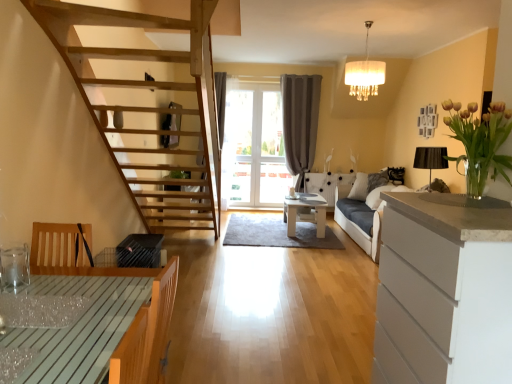
At what (x,y) coordinates should I click in order to perform the action: click on translucent glass vase at upper right. Please return your answer as a coordinate pair (x, y). Looking at the image, I should click on (480, 142).

Describe the element at coordinates (362, 214) in the screenshot. I see `dark gray fabric couch at right` at that location.

What do you see at coordinates (365, 74) in the screenshot?
I see `white fabric lampshade at upper center` at bounding box center [365, 74].

At what (x,y) coordinates should I click in order to perform the action: click on gray fabric curtain at center. Please return your answer as a coordinate pair (x, y). Image resolution: width=512 pixels, height=384 pixels. Looking at the image, I should click on (300, 122).

What do you see at coordinates (444, 292) in the screenshot?
I see `white matte cabinet at right` at bounding box center [444, 292].

The image size is (512, 384). In order to click on translucent glass vase at upper right in this screenshot , I will do `click(480, 142)`.

Is white glossy table at center, the 1th table viewed from the back, not within translucent glass vase at upper right?

Yes, white glossy table at center, the 1th table viewed from the back, is not within translucent glass vase at upper right.

From the image's perspective, is white glossy table at center, the second table when ordered from left to right, located beneath translucent glass vase at upper right?

Indeed, from the image's perspective, white glossy table at center, the second table when ordered from left to right, is shown beneath translucent glass vase at upper right.

Is white glossy table at center, which is the 2th table from front to back, in front of or behind translucent glass vase at upper right in the image?

white glossy table at center, which is the 2th table from front to back, is behind translucent glass vase at upper right.

Is white glossy table at center, the second table when ordered from left to right, facing away from translucent glass vase at upper right?

No, white glossy table at center, the second table when ordered from left to right, is not facing the opposite direction of translucent glass vase at upper right.

From the image's perspective, which object appears higher, transparent glass table at lower left or dark gray fabric couch at right?

dark gray fabric couch at right is shown above in the image.

Between transparent glass table at lower left and dark gray fabric couch at right, which one has less height?

With less height is transparent glass table at lower left.

Is transparent glass table at lower left looking in the opposite direction of dark gray fabric couch at right?

transparent glass table at lower left does not have its back to dark gray fabric couch at right.

Does point (72, 305) lie behind point (362, 181)?

No, it is in front of (362, 181).

Identify the location of couch located on the right of wooden table at lower left, which is the 2th table in right-to-left order. (362, 214).

Looking at this image, considering the relative positions of dark gray fabric couch at right and wooden table at lower left, which is the 2th table in right-to-left order, in the image provided, is dark gray fabric couch at right to the right of wooden table at lower left, which is the 2th table in right-to-left order, from the viewer's perspective?

Yes.

Which object is thinner, dark gray fabric couch at right or wooden table at lower left, the first table positioned from the left?

With smaller width is wooden table at lower left, the first table positioned from the left.

Based on the photo, which object is wider, white fabric lampshade at upper center or wooden table at lower left, the first table viewed from the front?

With larger width is wooden table at lower left, the first table viewed from the front.

What's the angular difference between white fabric lampshade at upper center and wooden table at lower left, the first table viewed from the front,'s facing directions?

There is a 178-degree angle between the facing directions of white fabric lampshade at upper center and wooden table at lower left, the first table viewed from the front.

From a real-world perspective, which is physically above, white fabric lampshade at upper center or wooden table at lower left, the first table positioned from the left?

white fabric lampshade at upper center is physically above.

Considering the relative positions of white fabric lampshade at upper center and wooden table at lower left, arranged as the 2th table when viewed from the back, in the image provided, is white fabric lampshade at upper center behind wooden table at lower left, arranged as the 2th table when viewed from the back,?

Yes, the depth of white fabric lampshade at upper center is greater than that of wooden table at lower left, arranged as the 2th table when viewed from the back.

Is dark gray fabric couch at right at the left side of white matte cabinet at right?

No, dark gray fabric couch at right is not to the left of white matte cabinet at right.

Which object is further away from the camera taking this photo, dark gray fabric couch at right or white matte cabinet at right?

Positioned behind is dark gray fabric couch at right.

How much distance is there between dark gray fabric couch at right and white matte cabinet at right?

dark gray fabric couch at right and white matte cabinet at right are 11.16 feet apart from each other.

How many degrees apart are the facing directions of dark gray fabric couch at right and white matte cabinet at right?

dark gray fabric couch at right and white matte cabinet at right are facing 0.793 degrees away from each other.

How many degrees apart are the facing directions of white matte cabinet at right and wooden table at lower left, the first table positioned from the left?

The angle between the facing direction of white matte cabinet at right and the facing direction of wooden table at lower left, the first table positioned from the left, is 180 degrees.

Is white matte cabinet at right not near wooden table at lower left, the first table positioned from the left?

Yes, white matte cabinet at right and wooden table at lower left, the first table positioned from the left, are quite far apart.

Can we say white matte cabinet at right lies outside wooden table at lower left, arranged as the 2th table when viewed from the back?

Indeed, white matte cabinet at right is completely outside wooden table at lower left, arranged as the 2th table when viewed from the back.

Can you confirm if white matte cabinet at right is positioned to the left of wooden table at lower left, arranged as the 2th table when viewed from the back?

Incorrect, white matte cabinet at right is not on the left side of wooden table at lower left, arranged as the 2th table when viewed from the back.

From the image's perspective, who appears lower, white glossy table at center, the 1th table viewed from the back, or white matte cabinet at right?

white matte cabinet at right, from the image's perspective.

How different are the orientations of white glossy table at center, which is the 2th table from front to back, and white matte cabinet at right in degrees?

The angle between the facing direction of white glossy table at center, which is the 2th table from front to back, and the facing direction of white matte cabinet at right is 1.95 degrees.

Considering the positions of objects white glossy table at center, placed as the 1th table when sorted from right to left, and white matte cabinet at right in the image provided, who is more to the right, white glossy table at center, placed as the 1th table when sorted from right to left, or white matte cabinet at right?

white matte cabinet at right is more to the right.

Identify the location of flower that is above the white glossy table at center, the second table when ordered from left to right (from a real-world perspective). (480, 142).

Identify the location of couch above the transparent glass table at lower left (from the image's perspective). This screenshot has width=512, height=384. (362, 214).

Which object lies further to the anchor point dark gray fabric couch at right, gray fabric curtain at center or white glossy table at center, which is the 2th table from front to back?

gray fabric curtain at center lies further to dark gray fabric couch at right than the other object.

Looking at the image, which one is located closer to dark gray fabric couch at right, white fabric lampshade at upper center or white glossy table at center, which is the 2th table from front to back?

white glossy table at center, which is the 2th table from front to back, is closer to dark gray fabric couch at right.

Based on their spatial positions, is dark gray fabric couch at right or wooden table at lower left, the first table positioned from the left, closer to translucent glass vase at upper right?

wooden table at lower left, the first table positioned from the left, is closer to translucent glass vase at upper right.

Which object lies further to the anchor point gray fabric curtain at center, translucent glass vase at upper right or white fabric lampshade at upper center?

Among the two, translucent glass vase at upper right is located further to gray fabric curtain at center.

Considering their positions, is translucent glass vase at upper right positioned closer to white glossy table at center, placed as the 1th table when sorted from right to left, than white fabric lampshade at upper center?

The object closer to white glossy table at center, placed as the 1th table when sorted from right to left, is white fabric lampshade at upper center.

Considering their positions, is wooden table at lower left, the first table positioned from the left, positioned further to white fabric lampshade at upper center than translucent glass vase at upper right?

wooden table at lower left, the first table positioned from the left, is further to white fabric lampshade at upper center.

From the image, which object appears to be farther from white fabric lampshade at upper center, transparent glass table at lower left or translucent glass vase at upper right?

transparent glass table at lower left.

Looking at this image, from the image, which object appears to be farther from translucent glass vase at upper right, white fabric lampshade at upper center or transparent glass table at lower left?

Based on the image, white fabric lampshade at upper center appears to be further to translucent glass vase at upper right.

You are a GUI agent. You are given a task and a screenshot of the screen. Output one action in this format:
    pyautogui.click(x=<x>, y=<y>)
    Task: Click on the glass table positioned between white matte cabinet at right and gray fabric curtain at center from near to far
    
    Given the screenshot: What is the action you would take?
    pyautogui.click(x=41, y=310)

Identify the location of flower between white matte cabinet at right and dark gray fabric couch at right from front to back. (480, 142).

Locate an element on the screen. table between transparent glass table at lower left and gray fabric curtain at center from front to back is located at coordinates (305, 214).

Identify the location of couch between wooden table at lower left, the first table positioned from the left, and gray fabric curtain at center, along the z-axis. (362, 214).